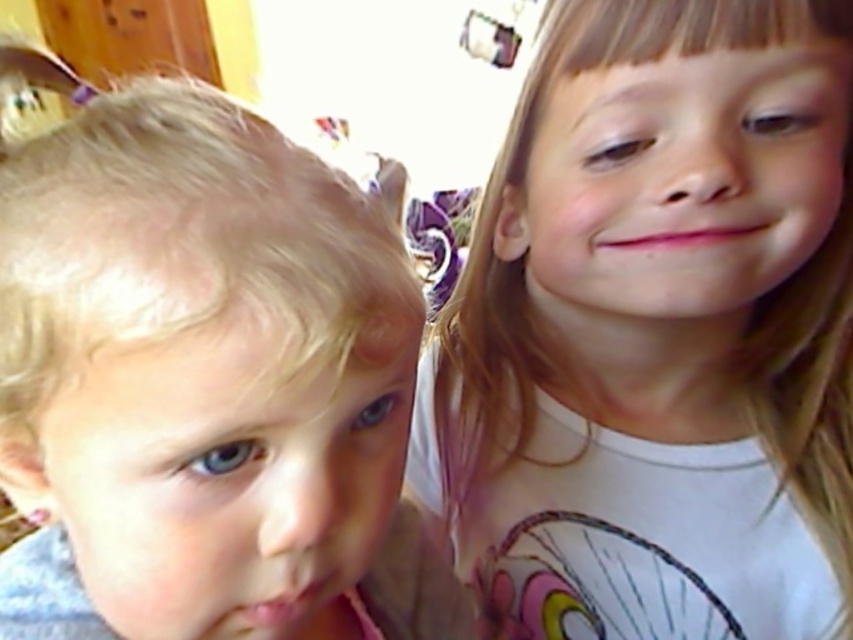
Does smooth white shirt at right have a lesser height compared to blonde hair at left?

No, smooth white shirt at right is not shorter than blonde hair at left.

Which is in front, point (751, 525) or point (164, 364)?

Point (164, 364)

At what (x,y) coordinates should I click in order to perform the action: click on smooth white shirt at right. Please return your answer as a coordinate pair (x, y). Looking at the image, I should click on click(x=656, y=333).

In the scene shown: Can you confirm if smooth white shirt at right is positioned to the left of pink matte lips at center?

In fact, smooth white shirt at right is to the right of pink matte lips at center.

Does smooth white shirt at right have a larger size compared to pink matte lips at center?

Indeed, smooth white shirt at right has a larger size compared to pink matte lips at center.

Between point (431, 461) and point (757, 224), which one is positioned in front?

Point (757, 224)

Where is `smooth white shirt at right`? The image size is (853, 640). smooth white shirt at right is located at coordinates (656, 333).

Does smooth white shirt at right appear on the left side of pink matte lips at lower left?

No, smooth white shirt at right is not to the left of pink matte lips at lower left.

Who is taller, smooth white shirt at right or pink matte lips at lower left?

Standing taller between the two is smooth white shirt at right.

Image resolution: width=853 pixels, height=640 pixels. What do you see at coordinates (656, 333) in the screenshot? I see `smooth white shirt at right` at bounding box center [656, 333].

Locate an element on the screen. Image resolution: width=853 pixels, height=640 pixels. smooth white shirt at right is located at coordinates click(656, 333).